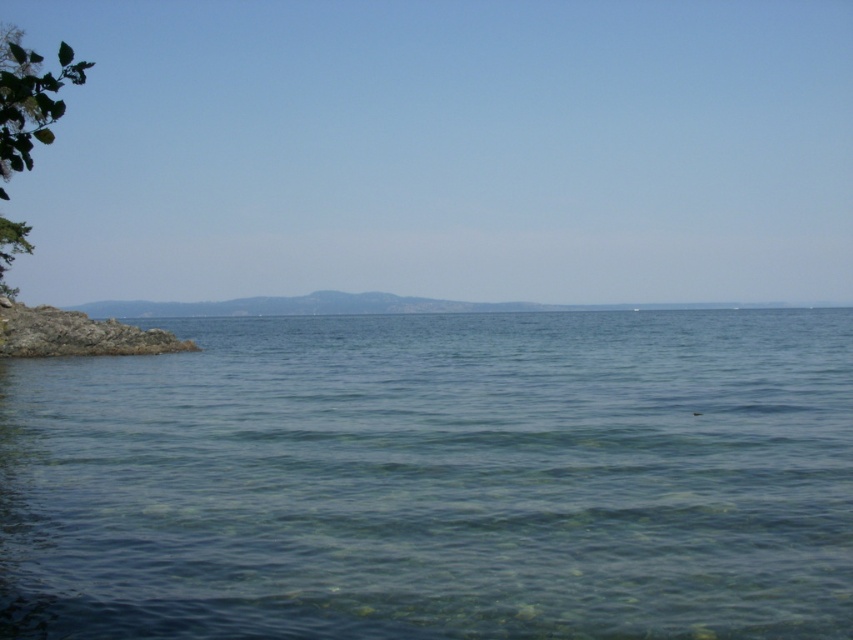
You are a kayaker approaching the coast and need to choose between paddling through the clear water at left or the rocky shore at lower left. Which path is wider?

The clear water at left is wider than the rocky shore at lower left, so the clear water at left is the wider path.

You are a photographer planning to capture the rocky shore at lower left and the clear water at left in a single shot. Given that your camera has a limited field of view, which object should you prioritize framing first to ensure both are visible?

Since the clear water at left is bigger than the rocky shore at lower left, you should prioritize framing the clear water at left first to ensure both objects fit within the camera frame.

You are a swimmer planning to swim from the clear water at left to the rocky shore at lower left. Which direction should you swim to reach the shore?

You should swim towards the rocky shore at lower left because the clear water at left is in front of it, meaning the shore is behind the water from your perspective.